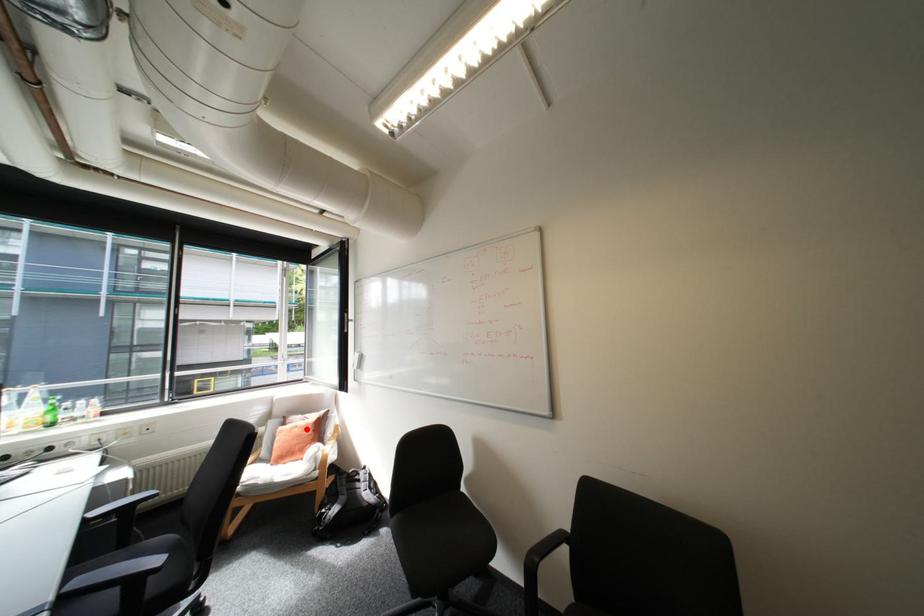
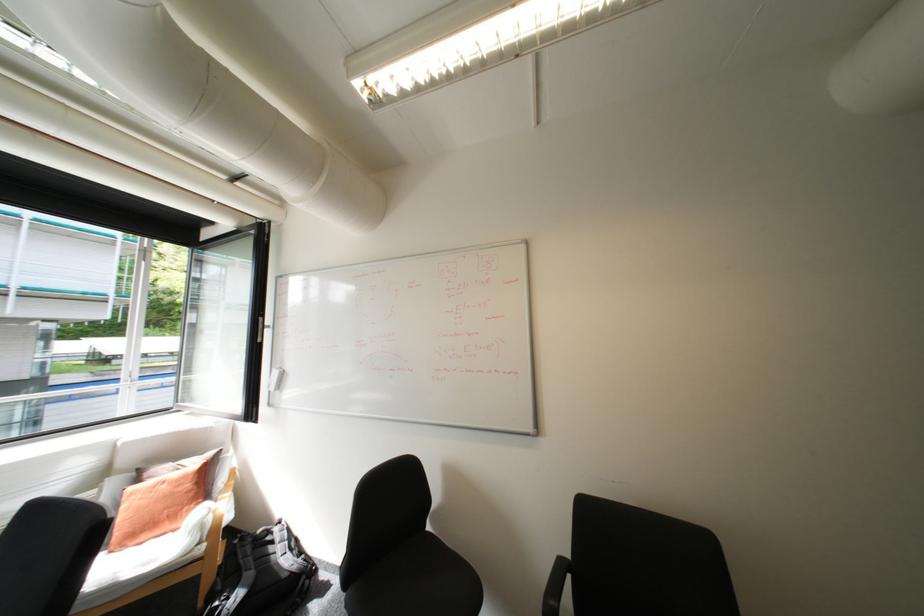
Question: I am providing you with two images of the same scene from different viewpoints. In image1, a red point is highlighted. Considering the same 3D point in image2, which of the following is correct?

Choices:
 (A) It is closer
 (B) It is farther

Answer: (A)